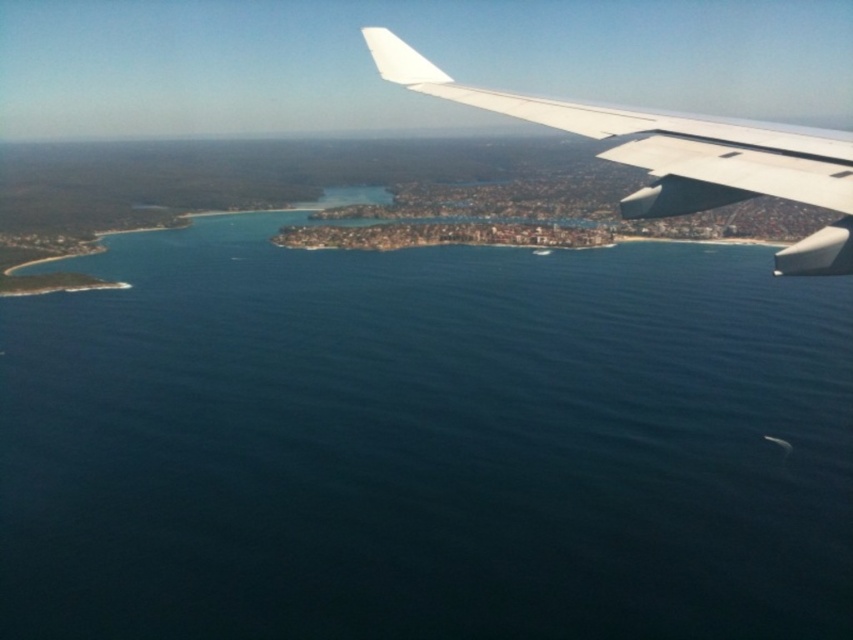
Question: Is deep blue water at center positioned at the back of white matte wing at upper right?

Choices:
 (A) yes
 (B) no

Answer: (A)

Question: Which point is farther to the camera?

Choices:
 (A) (x=828, y=269)
 (B) (x=0, y=328)

Answer: (B)

Question: Considering the relative positions of deep blue water at center and white matte wing at upper right in the image provided, where is deep blue water at center located with respect to white matte wing at upper right?

Choices:
 (A) above
 (B) below

Answer: (A)

Question: Observing the image, what is the correct spatial positioning of deep blue water at center in reference to white matte wing at upper right?

Choices:
 (A) below
 (B) above

Answer: (B)

Question: Which point is farther from the camera taking this photo?

Choices:
 (A) (660, 173)
 (B) (775, 426)

Answer: (B)

Question: Which of the following is the closest to the observer?

Choices:
 (A) (556, 554)
 (B) (489, 92)

Answer: (B)